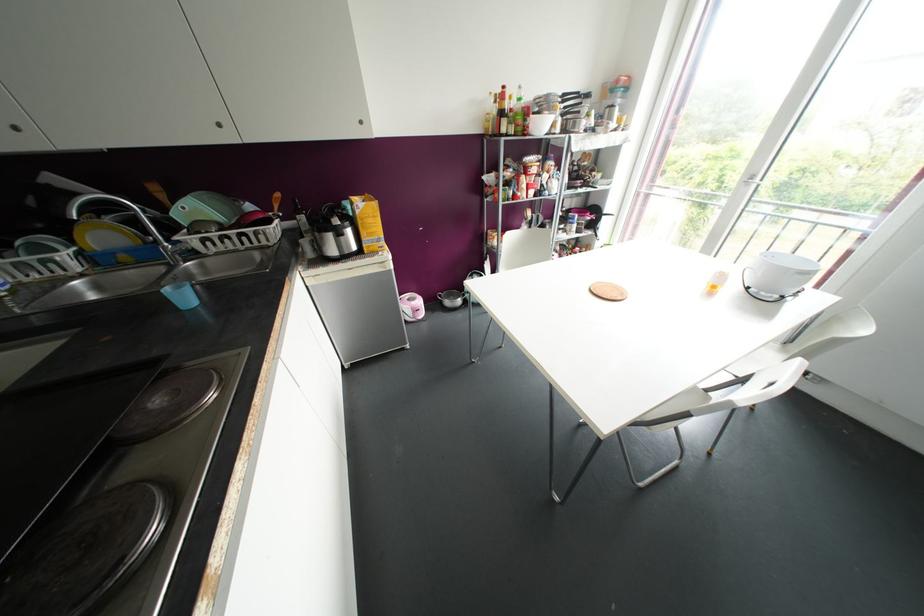
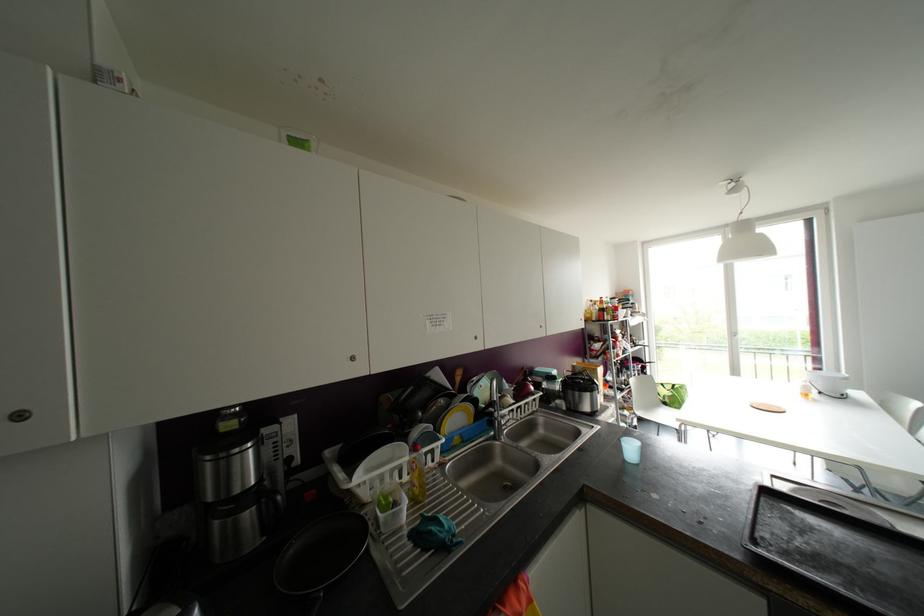
The point at (164, 248) is marked in the first image. Where is the corresponding point in the second image?

(499, 422)